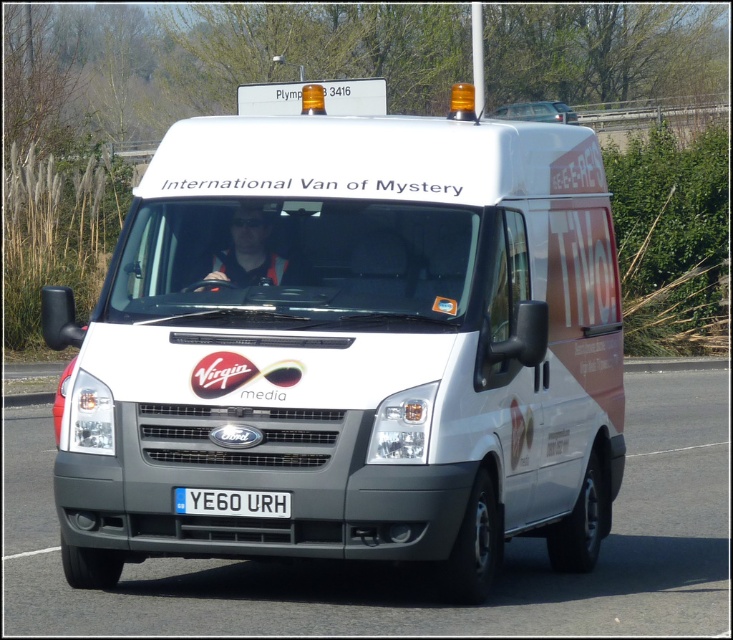
You are a delivery driver who needs to attach a new license plate to the van. The new plate must be placed exactly 5 feet away from the current white matte van at center. Can you place it in the same location as the existing white rectangular license plate at center?

The white matte van at center is 4.11 feet away from the white rectangular license plate at center. Since the new plate needs to be placed 5 feet away, it cannot be placed in the same location as the existing plate because that spot is only 4.11 feet away.

You are a traffic officer observing a white matte van at center with a white rectangular license plate at center. Where is the license plate located in relation to the van?

The white rectangular license plate at center is below the white matte van at center because the van is above it.

You are standing on the side of the road and see the white Ford Transit van with Virgin Media branding. Where is the point located at coordinates (x=350, y=348) in relation to the van?

The point at coordinates (x=350, y=348) corresponds to the white matte van at center.